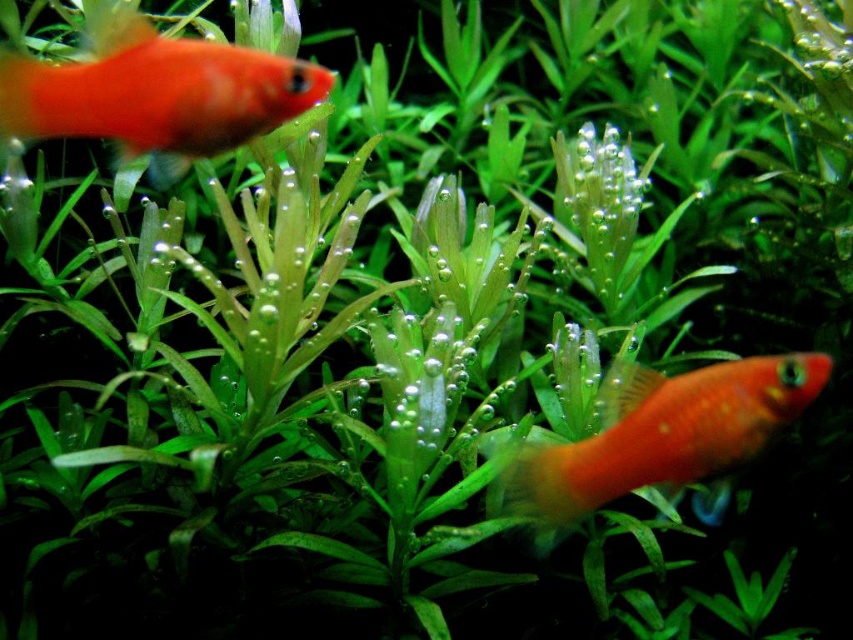
Which is above, matte orange fish at upper left or matte orange fish at lower right?

matte orange fish at upper left

Can you confirm if matte orange fish at upper left is positioned below matte orange fish at lower right?

No, matte orange fish at upper left is not below matte orange fish at lower right.

Between point (137, 44) and point (583, 486), which one is positioned behind?

The point (137, 44) is more distant.

Locate an element on the screen. The width and height of the screenshot is (853, 640). matte orange fish at upper left is located at coordinates (157, 93).